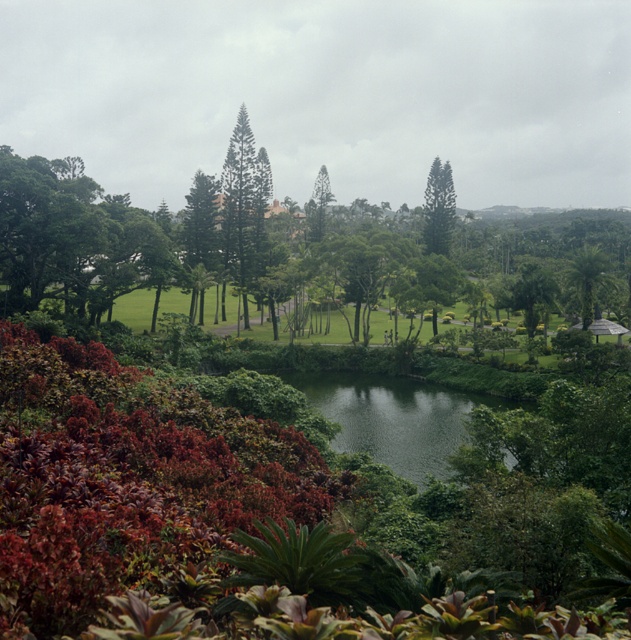
Question: Can you confirm if green leafy palm at right is positioned to the left of green textured tree at center?

Choices:
 (A) no
 (B) yes

Answer: (A)

Question: Which point is farther from the camera taking this photo?

Choices:
 (A) (584, 328)
 (B) (261, 264)
 (C) (437, 156)
 (D) (322, 230)

Answer: (D)

Question: Is green textured pine tree at upper center below green leafy palm at right?

Choices:
 (A) no
 (B) yes

Answer: (A)

Question: In this image, where is green textured pine tree at center located relative to green textured pine tree at upper center?

Choices:
 (A) above
 (B) below

Answer: (B)

Question: Which is nearer to the green textured pine tree at upper center?

Choices:
 (A) green textured pine tree at center
 (B) green textured tree at center

Answer: (B)

Question: Which point is closer to the camera?

Choices:
 (A) green textured pine tree at center
 (B) green textured tree at center
 (C) green leafy palm at right
 (D) green textured pine tree at upper center

Answer: (C)